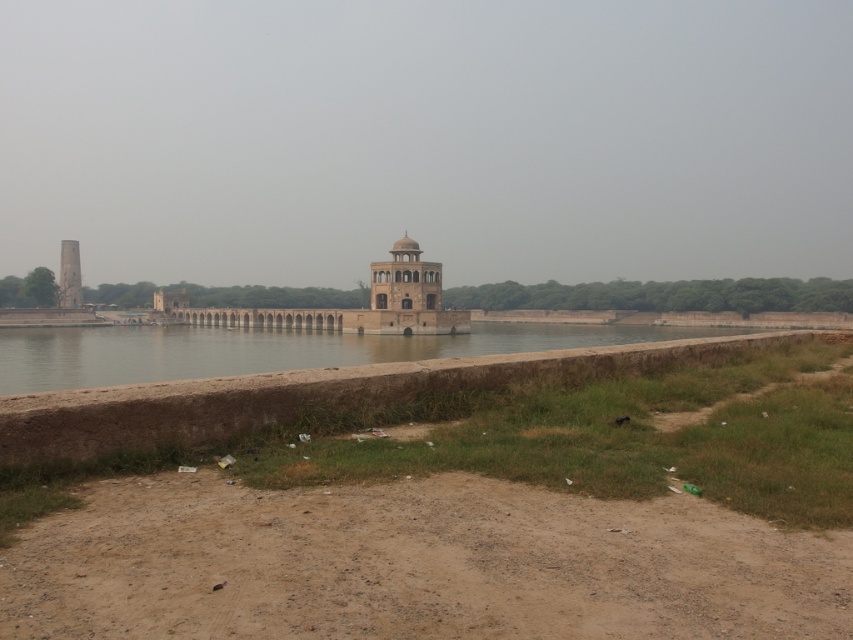
Question: Does smooth stone palace at center come in front of smooth white tower at left?

Choices:
 (A) yes
 (B) no

Answer: (A)

Question: Which point appears closest to the camera in this image?

Choices:
 (A) (415, 291)
 (B) (68, 253)

Answer: (A)

Question: Among these objects, which one is nearest to the camera?

Choices:
 (A) smooth white tower at left
 (B) smooth stone palace at center

Answer: (B)

Question: Is smooth stone palace at center thinner than smooth white tower at left?

Choices:
 (A) yes
 (B) no

Answer: (B)

Question: Among these points, which one is farthest from the camera?

Choices:
 (A) (387, 307)
 (B) (73, 282)

Answer: (B)

Question: Is smooth stone palace at center to the left of smooth white tower at left from the viewer's perspective?

Choices:
 (A) yes
 (B) no

Answer: (B)